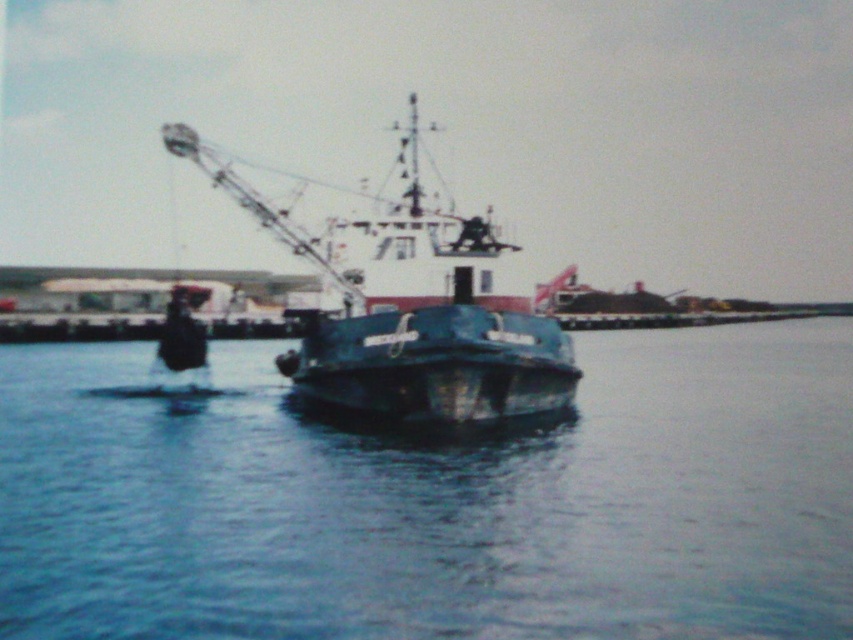
Does blue matte water at center lie in front of blue metallic boat at center?

Yes, it is in front of blue metallic boat at center.

Can you confirm if blue matte water at center is smaller than blue metallic boat at center?

Correct, blue matte water at center occupies less space than blue metallic boat at center.

Is point (25, 580) positioned after point (204, 164)?

No, (25, 580) is closer to viewer.

This screenshot has width=853, height=640. Find the location of `blue matte water at center`. blue matte water at center is located at coordinates (437, 500).